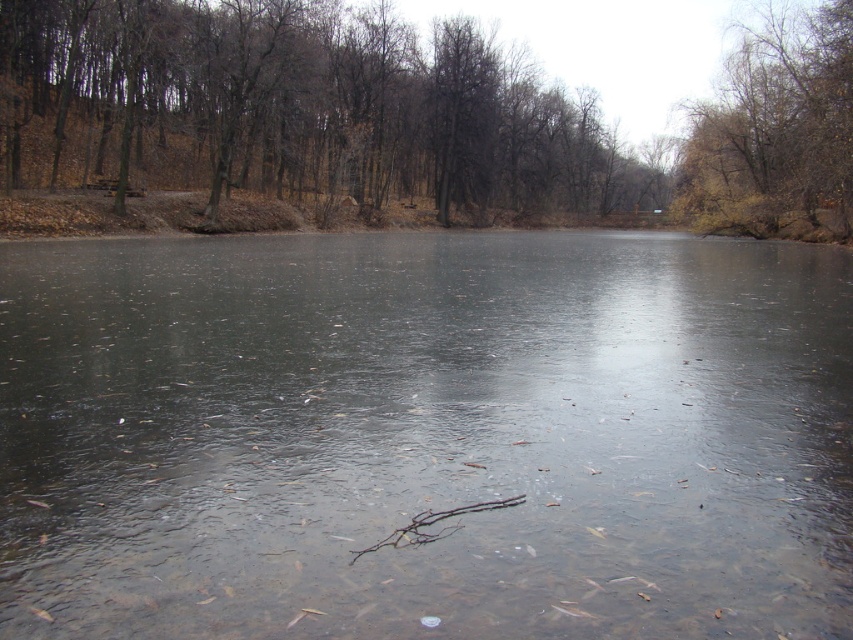
You are standing at the center of the frozen pond in the winter scene. You notice a point marked at coordinates (300, 108). What object is located at that point?

The point at coordinates (300, 108) corresponds to brown dry wood located at the left side of the frozen pond.